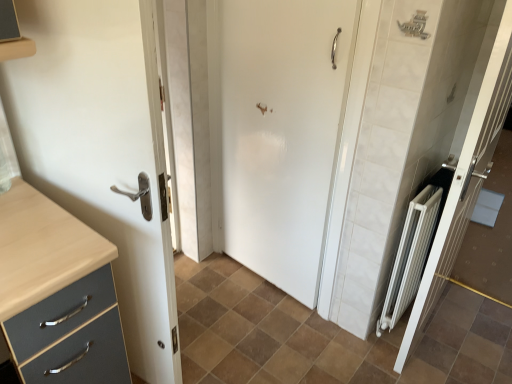
The image size is (512, 384). I want to click on free space in front of white metallic radiator at right, marked as the third door in a left-to-right arrangement, so (455, 364).